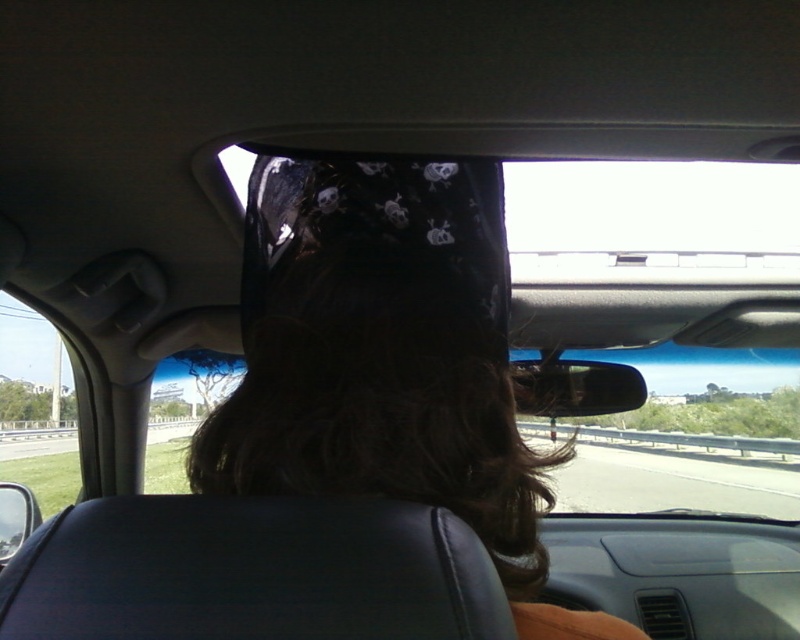
Question: Can you confirm if black fabric bandana at center is positioned to the right of glossy plastic view mirror at center?

Choices:
 (A) no
 (B) yes

Answer: (A)

Question: Which point is farther from the camera taking this photo?

Choices:
 (A) (588, 381)
 (B) (417, 560)
 (C) (448, 172)

Answer: (A)

Question: Which object is the farthest from the glossy plastic view mirror at center?

Choices:
 (A) black fabric bandana at center
 (B) black leather headrest at center

Answer: (B)

Question: Can you confirm if black fabric bandana at center is smaller than glossy plastic view mirror at center?

Choices:
 (A) yes
 (B) no

Answer: (B)

Question: Does black fabric bandana at center appear on the left side of glossy plastic view mirror at center?

Choices:
 (A) yes
 (B) no

Answer: (A)

Question: Which point appears farthest from the camera in this image?

Choices:
 (A) (397, 209)
 (B) (320, 525)
 (C) (612, 380)

Answer: (C)